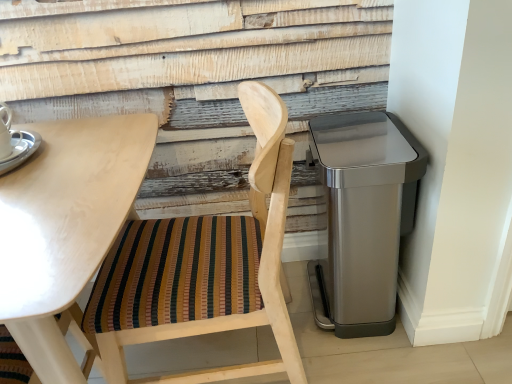
What do you see at coordinates (20, 149) in the screenshot? This screenshot has width=512, height=384. I see `silver metallic saucer at upper left` at bounding box center [20, 149].

Identify the location of silver metallic saucer at upper left. (20, 149).

Considering the sizes of objects light wood table at upper left and wooden chair with striped cushion at left in the image provided, who is taller, light wood table at upper left or wooden chair with striped cushion at left?

wooden chair with striped cushion at left.

Is light wood table at upper left facing away from wooden chair with striped cushion at left?

No.

Does point (8, 249) appear closer or farther from the camera than point (172, 228)?

Point (8, 249) is closer to the camera than point (172, 228).

Is light wood table at upper left surrounding wooden chair with striped cushion at left?

No, wooden chair with striped cushion at left is not surrounded by light wood table at upper left.

Considering the relative sizes of satin silver trash can at right and light wood table at upper left in the image provided, is satin silver trash can at right smaller than light wood table at upper left?

Yes.

In terms of width, does satin silver trash can at right look wider or thinner when compared to light wood table at upper left?

In the image, satin silver trash can at right appears to be more narrow than light wood table at upper left.

Can you tell me how much satin silver trash can at right and light wood table at upper left differ in facing direction?

The angular difference between satin silver trash can at right and light wood table at upper left is 0.0323 degrees.

Is point (375, 119) in front of point (100, 210)?

That is False.

Which object is thinner, light wood table at upper left or satin silver trash can at right?

Thinner between the two is satin silver trash can at right.

From the image's perspective, which is below, light wood table at upper left or satin silver trash can at right?

light wood table at upper left appears lower in the image.

At what (x,y) coordinates should I click in order to perform the action: click on waste container to the right of light wood table at upper left. Please return your answer as a coordinate pair (x, y). The width and height of the screenshot is (512, 384). Looking at the image, I should click on (362, 217).

From a real-world perspective, between silver metallic saucer at upper left and light wood table at upper left, who is vertically lower?

From a 3D spatial view, light wood table at upper left is below.

Does silver metallic saucer at upper left have a greater height compared to light wood table at upper left?

No.

Considering the points (425, 169) and (21, 157), which point is behind, point (425, 169) or point (21, 157)?

Positioned behind is point (425, 169).

From the image's perspective, is satin silver trash can at right below silver metallic saucer at upper left?

Indeed, from the image's perspective, satin silver trash can at right is shown beneath silver metallic saucer at upper left.

How distant is satin silver trash can at right from silver metallic saucer at upper left?

A distance of 1.01 meters exists between satin silver trash can at right and silver metallic saucer at upper left.

How many degrees apart are the facing directions of satin silver trash can at right and silver metallic saucer at upper left?

They differ by 33.1 degrees in their facing directions.

Does satin silver trash can at right turn towards wooden chair with striped cushion at left?

No, satin silver trash can at right is not turned towards wooden chair with striped cushion at left.

Which of these two, satin silver trash can at right or wooden chair with striped cushion at left, is bigger?

Bigger between the two is wooden chair with striped cushion at left.

Based on the photo, is satin silver trash can at right not close to wooden chair with striped cushion at left?

No.

The image size is (512, 384). I want to click on chair in front of the satin silver trash can at right, so click(205, 267).

Does wooden chair with striped cushion at left appear on the left side of silver metallic saucer at upper left?

Incorrect, wooden chair with striped cushion at left is not on the left side of silver metallic saucer at upper left.

Based on the photo, is wooden chair with striped cushion at left bigger or smaller than silver metallic saucer at upper left?

Clearly, wooden chair with striped cushion at left is larger in size than silver metallic saucer at upper left.

Is wooden chair with striped cushion at left turned away from silver metallic saucer at upper left?

No.

Consider the image. Is wooden chair with striped cushion at left closer to the viewer compared to silver metallic saucer at upper left?

Yes, the depth of wooden chair with striped cushion at left is less than that of silver metallic saucer at upper left.

Find the location of `chair lying behind the light wood table at upper left`. chair lying behind the light wood table at upper left is located at coordinates (205, 267).

Locate an element on the screen. table in front of the satin silver trash can at right is located at coordinates (65, 227).

Estimate the real-world distances between objects in this image. Which object is further from satin silver trash can at right, wooden chair with striped cushion at left or silver metallic saucer at upper left?

The object further to satin silver trash can at right is silver metallic saucer at upper left.

From the image, which object appears to be farther from wooden chair with striped cushion at left, satin silver trash can at right or light wood table at upper left?

Based on the image, satin silver trash can at right appears to be further to wooden chair with striped cushion at left.

Looking at the image, which one is located further to wooden chair with striped cushion at left, light wood table at upper left or silver metallic saucer at upper left?

silver metallic saucer at upper left is further to wooden chair with striped cushion at left.

Estimate the real-world distances between objects in this image. Which object is further from wooden chair with striped cushion at left, silver metallic saucer at upper left or light wood table at upper left?

silver metallic saucer at upper left.

Based on their spatial positions, is light wood table at upper left or silver metallic saucer at upper left further from satin silver trash can at right?

silver metallic saucer at upper left is positioned further to the anchor satin silver trash can at right.

Which object lies nearer to the anchor point light wood table at upper left, silver metallic saucer at upper left or wooden chair with striped cushion at left?

silver metallic saucer at upper left is positioned closer to the anchor light wood table at upper left.

Considering their positions, is satin silver trash can at right positioned closer to wooden chair with striped cushion at left than silver metallic saucer at upper left?

satin silver trash can at right is closer to wooden chair with striped cushion at left.

Which object lies further to the anchor point satin silver trash can at right, silver metallic saucer at upper left or light wood table at upper left?

silver metallic saucer at upper left is further to satin silver trash can at right.

I want to click on chair located between silver metallic saucer at upper left and satin silver trash can at right in the left-right direction, so click(205, 267).

This screenshot has width=512, height=384. What are the coordinates of `table between silver metallic saucer at upper left and satin silver trash can at right in the horizontal direction` in the screenshot? It's located at (65, 227).

You are a GUI agent. You are given a task and a screenshot of the screen. Output one action in this format:
    pyautogui.click(x=<x>, y=<y>)
    Task: Click on the table located between silver metallic saucer at upper left and wooden chair with striped cushion at left in the left-right direction
    
    Given the screenshot: What is the action you would take?
    pyautogui.click(x=65, y=227)

Find the location of a particular element. This screenshot has width=512, height=384. chair located between light wood table at upper left and satin silver trash can at right in the left-right direction is located at coordinates click(x=205, y=267).